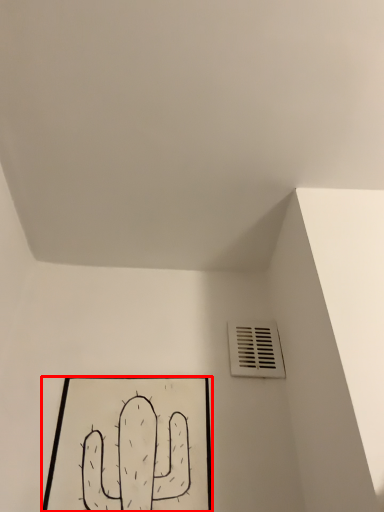
Question: From the image's perspective, considering the relative positions of picture frame (annotated by the red box) and air conditioning in the image provided, where is picture frame (annotated by the red box) located with respect to the staircase?

Choices:
 (A) above
 (B) below

Answer: (B)